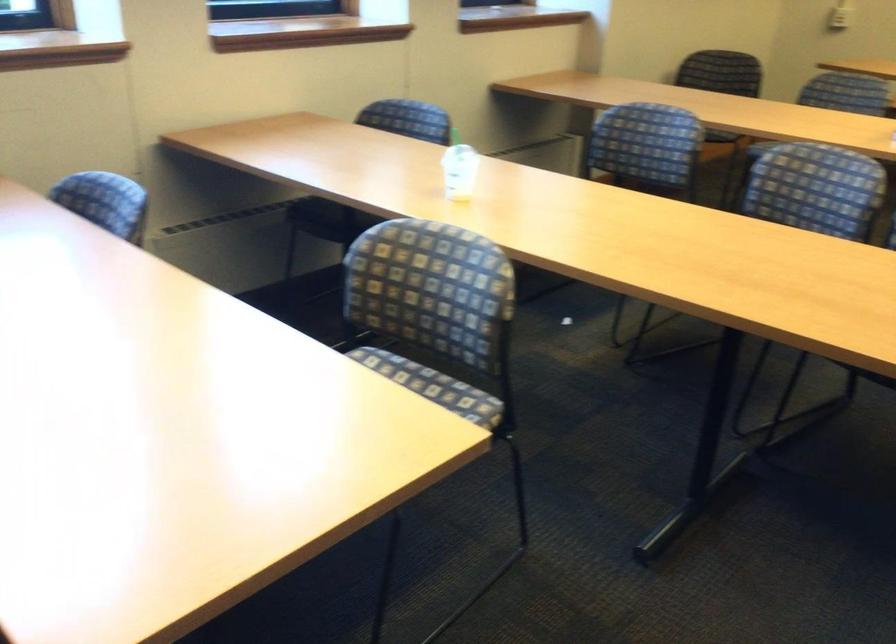
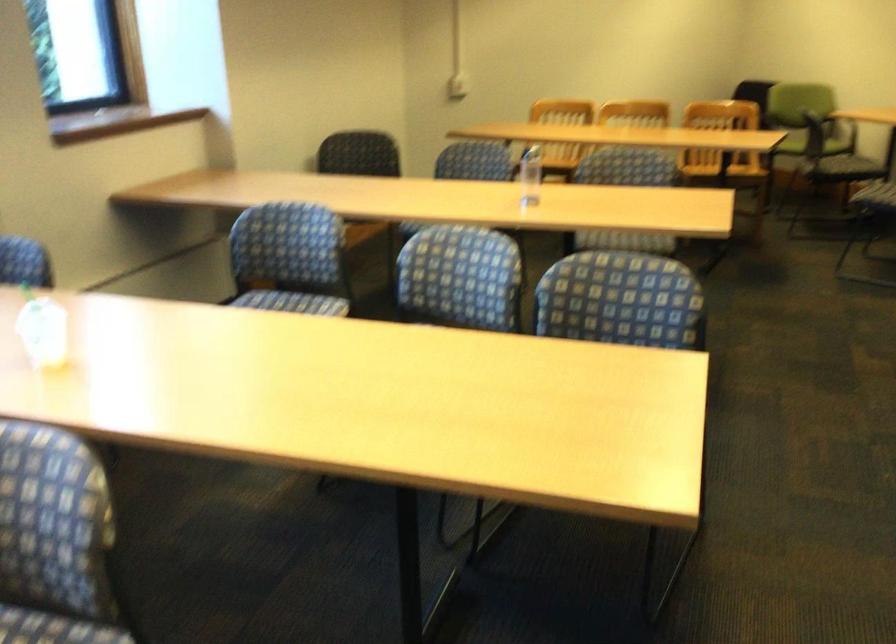
The images are taken continuously from a first-person perspective. In which direction are you moving?

The cameraman moved toward right, forward.